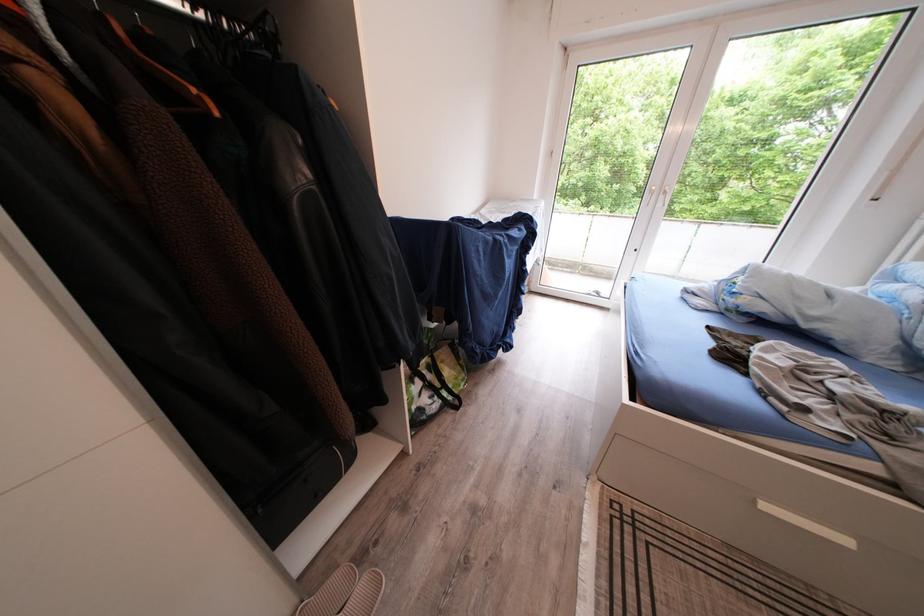
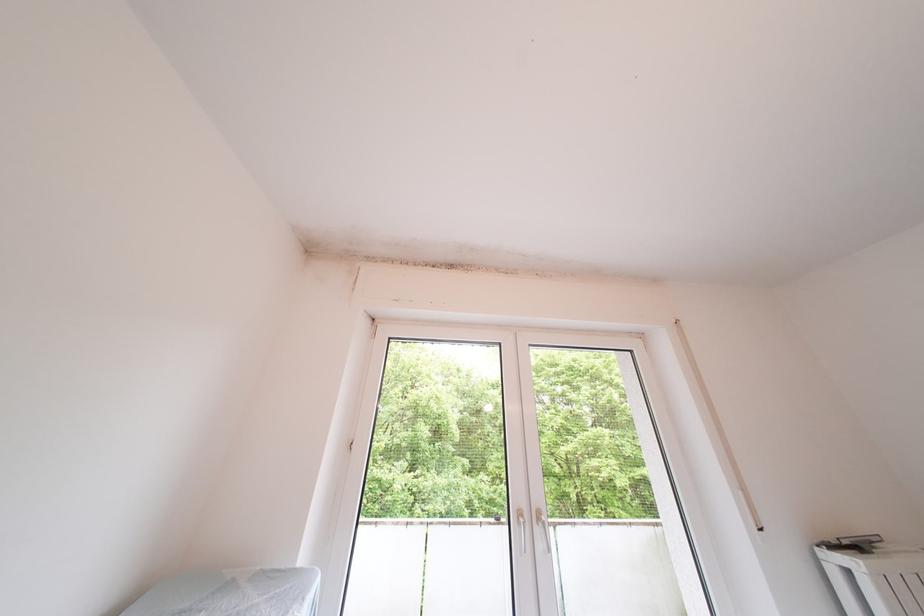
Where in the second image is the point corresponding to (x=667, y=209) from the first image?

(550, 552)